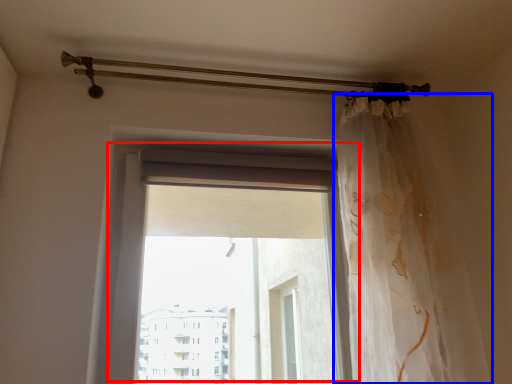
Question: Among these objects, which one is nearest to the camera, window (highlighted by a red box) or curtain (highlighted by a blue box)?

Choices:
 (A) window
 (B) curtain

Answer: (B)